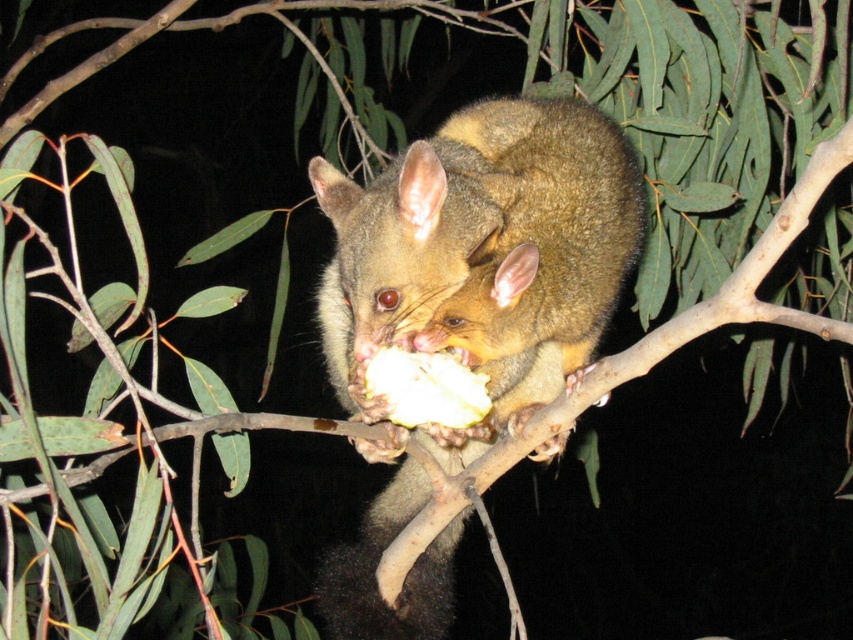
Is furry brown possum at center to the right of white matte fruit at center from the viewer's perspective?

In fact, furry brown possum at center is to the left of white matte fruit at center.

Based on the photo, can you confirm if furry brown possum at center is smaller than white matte fruit at center?

No, furry brown possum at center is not smaller than white matte fruit at center.

You are a GUI agent. You are given a task and a screenshot of the screen. Output one action in this format:
    pyautogui.click(x=<x>, y=<y>)
    Task: Click on the furry brown possum at center
    
    Given the screenshot: What is the action you would take?
    pyautogui.click(x=485, y=256)